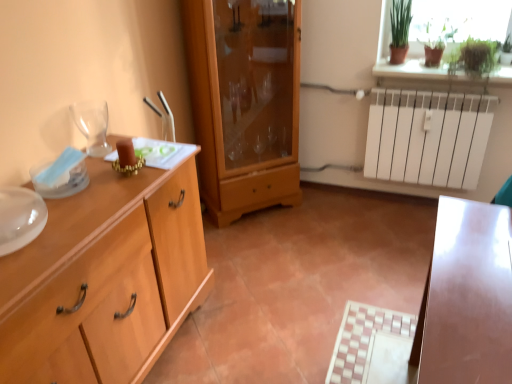
Question: Does transparent glass wine glass at left have a lesser height compared to green matte plant at upper right?

Choices:
 (A) yes
 (B) no

Answer: (A)

Question: Is transparent glass wine glass at left smaller than green matte plant at upper right?

Choices:
 (A) yes
 (B) no

Answer: (A)

Question: Is transparent glass wine glass at left to the left of green matte plant at upper right from the viewer's perspective?

Choices:
 (A) yes
 (B) no

Answer: (A)

Question: Is transparent glass wine glass at left outside of green matte plant at upper right?

Choices:
 (A) yes
 (B) no

Answer: (A)

Question: Is transparent glass wine glass at left thinner than green matte plant at upper right?

Choices:
 (A) no
 (B) yes

Answer: (B)

Question: Is transparent glass wine glass at left not near green matte plant at upper right?

Choices:
 (A) no
 (B) yes

Answer: (B)

Question: Are transparent glass wine glass at left and light wood chest of drawers at left beside each other?

Choices:
 (A) yes
 (B) no

Answer: (B)

Question: From a real-world perspective, does transparent glass wine glass at left stand above light wood chest of drawers at left?

Choices:
 (A) no
 (B) yes

Answer: (B)

Question: Could you tell me if transparent glass wine glass at left is facing light wood chest of drawers at left?

Choices:
 (A) no
 (B) yes

Answer: (A)

Question: Is transparent glass wine glass at left thinner than light wood chest of drawers at left?

Choices:
 (A) yes
 (B) no

Answer: (A)

Question: Can you confirm if transparent glass wine glass at left is shorter than light wood chest of drawers at left?

Choices:
 (A) yes
 (B) no

Answer: (A)

Question: Is light wood chest of drawers at left completely or partially inside transparent glass wine glass at left?

Choices:
 (A) no
 (B) yes

Answer: (A)

Question: Is light wood chest of drawers at left directly adjacent to green matte plant at upper right?

Choices:
 (A) yes
 (B) no

Answer: (B)